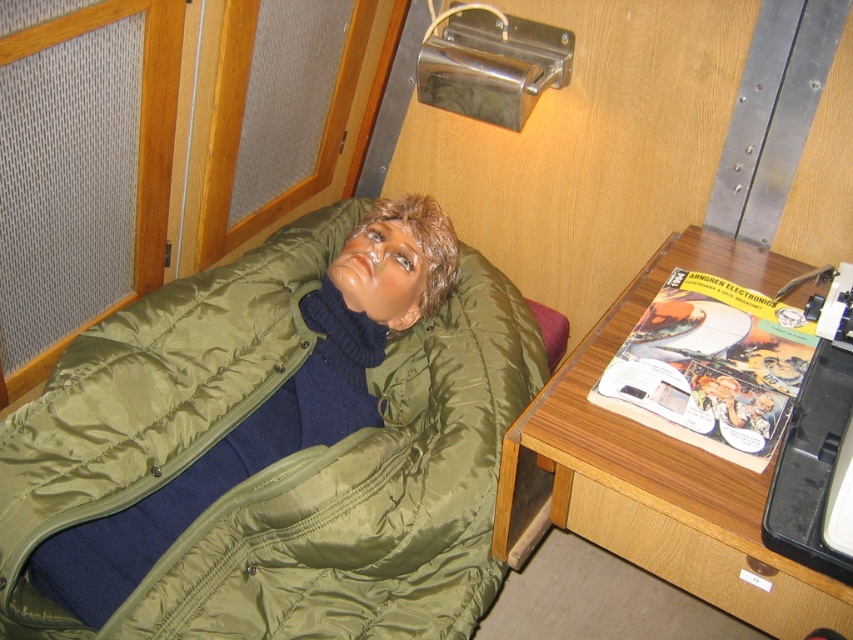
You are organizing the cabin and need to place a new item on the wooden desk at lower right. However, there is an olive green quilted jacket at center currently occupying the space. Can you place the new item on the desk without moving the jacket?

The olive green quilted jacket at center is positioned over the wooden desk at lower right, so it is currently occupying the desk. To place the new item, you would need to move the jacket first.

You are standing in the cabin and want to determine which of the two points, point (189, 467) or point (717, 243), is closer to you. Based on the scene, which point is nearer?

Point (189, 467) is closer to the camera than point (717, 243), so it is the nearer point.

You are a delivery robot with a package that measures 20 inches in length. You need to navigate through the cabin to place the package between the olive green quilted jacket at center and the wooden desk at lower right. Is there enough space for the package to fit between them?

The distance between the olive green quilted jacket at center and the wooden desk at lower right is 18.62 inches. Since the package is 20 inches long, it will not fit between them as the space is narrower than the package.